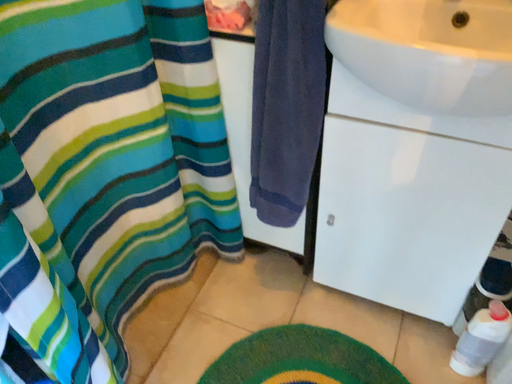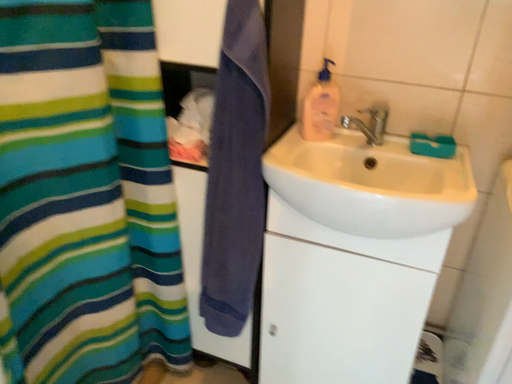
Question: How did the camera likely rotate when shooting the video?

Choices:
 (A) rotated downward
 (B) rotated upward

Answer: (B)